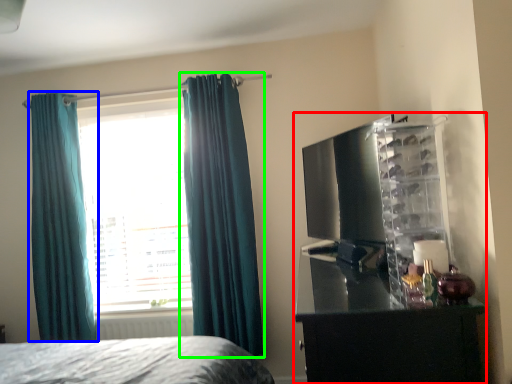
Question: Which is farther away from entertainment center (highlighted by a red box)? curtain (highlighted by a blue box) or curtain (highlighted by a green box)?

Choices:
 (A) curtain
 (B) curtain

Answer: (A)